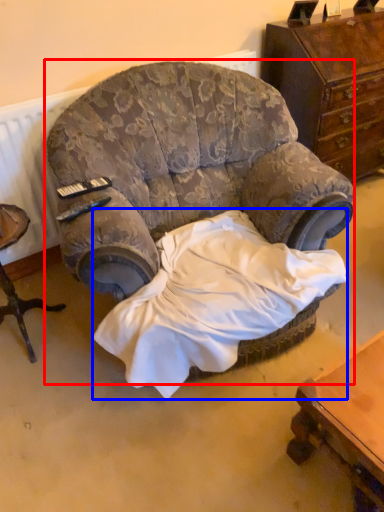
Question: Which object is closer to the camera taking this photo, chair (highlighted by a red box) or sheet (highlighted by a blue box)?

Choices:
 (A) chair
 (B) sheet

Answer: (A)